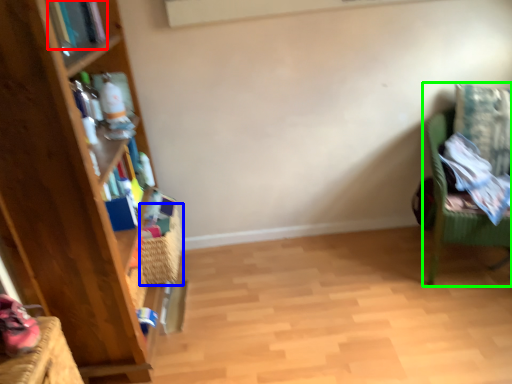
Question: Considering the real-world distances, which object is farthest from book (highlighted by a red box)? basket (highlighted by a blue box) or chair (highlighted by a green box)?

Choices:
 (A) basket
 (B) chair

Answer: (B)